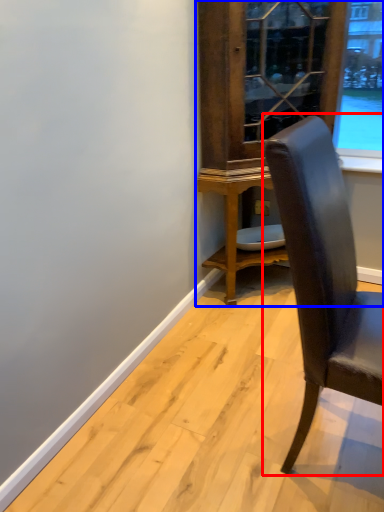
Question: Which object is further to the camera taking this photo, chair (highlighted by a red box) or dresser (highlighted by a blue box)?

Choices:
 (A) chair
 (B) dresser

Answer: (B)